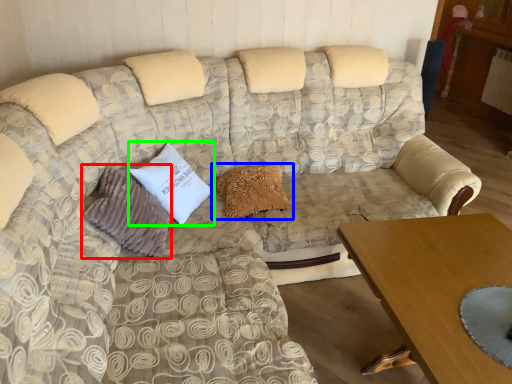
Question: Estimate the real-world distances between objects in this image. Which object is closer to pillow (highlighted by a red box), pillow (highlighted by a blue box) or pillow (highlighted by a green box)?

Choices:
 (A) pillow
 (B) pillow

Answer: (B)